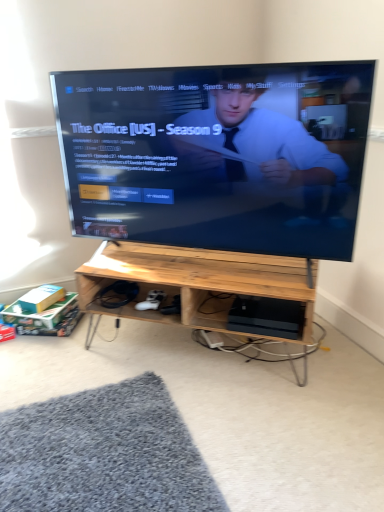
Question: Considering the positions of black glossy tv at center and natural wood desk at center in the image, is black glossy tv at center taller or shorter than natural wood desk at center?

Choices:
 (A) tall
 (B) short

Answer: (A)

Question: Relative to natural wood desk at center, is black glossy tv at center in front or behind?

Choices:
 (A) behind
 (B) front

Answer: (B)

Question: Considering the real-world distances, which object is farthest from the black plastic computer at lower center?

Choices:
 (A) natural wood desk at center
 (B) black glossy tv at center

Answer: (B)

Question: Which object is the closest to the black glossy tv at center?

Choices:
 (A) black plastic computer at lower center
 (B) natural wood desk at center

Answer: (B)